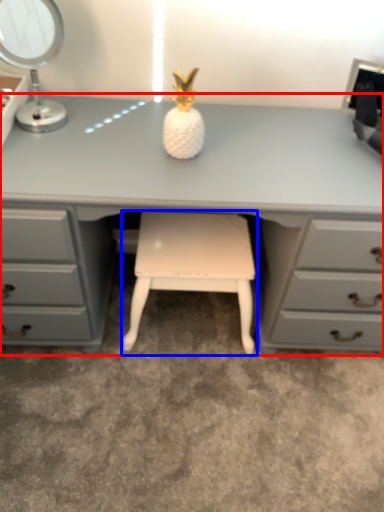
Question: Which object is further to the camera taking this photo, desk (highlighted by a red box) or stool (highlighted by a blue box)?

Choices:
 (A) desk
 (B) stool

Answer: (B)